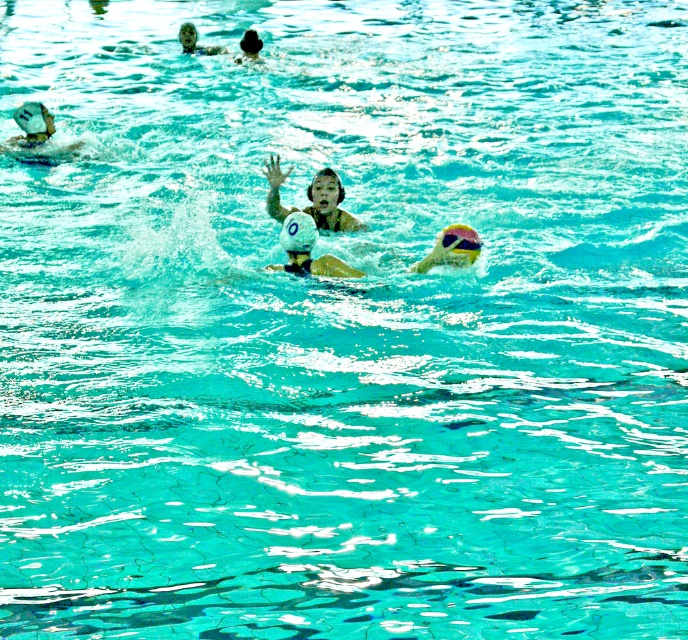
Does smooth white swimmer at center have a greater height compared to smooth skin face at upper center?

Yes.

Which is in front, point (332, 172) or point (211, 45)?

Point (332, 172)

Locate an element on the screen. This screenshot has height=640, width=688. smooth white swimmer at center is located at coordinates (330, 204).

Can you confirm if white matte water polo ball at center is wider than smooth black swimmer at upper center?

Yes.

Can you confirm if white matte water polo ball at center is thinner than smooth black swimmer at upper center?

In fact, white matte water polo ball at center might be wider than smooth black swimmer at upper center.

Which is in front, point (322, 257) or point (246, 32)?

Point (322, 257) is in front.

Locate an element on the screen. Image resolution: width=688 pixels, height=640 pixels. white matte water polo ball at center is located at coordinates (308, 250).

Who is shorter, smooth white swimmer at center or white matte water polo ball at center?

white matte water polo ball at center is shorter.

Does smooth white swimmer at center have a larger size compared to white matte water polo ball at center?

Correct, smooth white swimmer at center is larger in size than white matte water polo ball at center.

What do you see at coordinates (330, 204) in the screenshot? The image size is (688, 640). I see `smooth white swimmer at center` at bounding box center [330, 204].

Image resolution: width=688 pixels, height=640 pixels. Identify the location of smooth white swimmer at center. (330, 204).